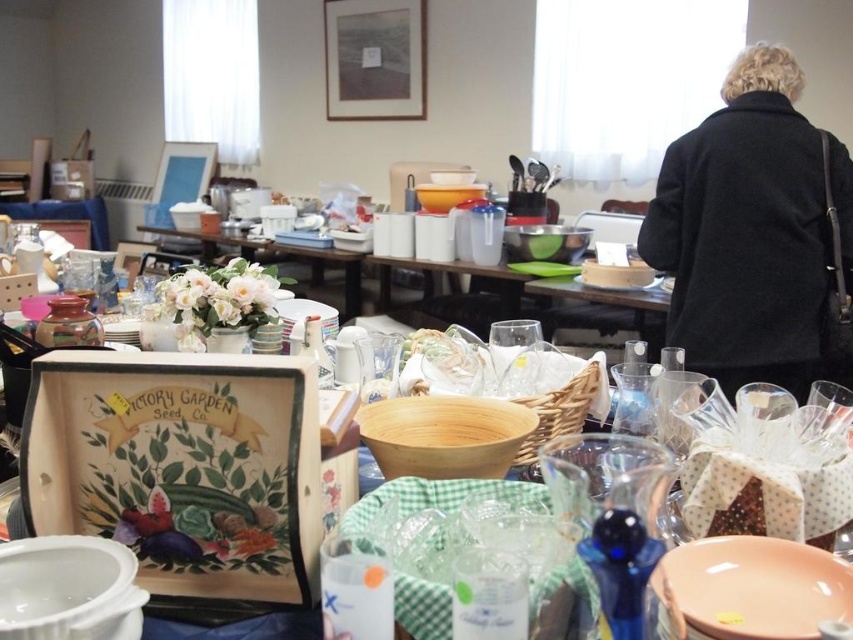
You are a customer at the flea market and want to examine both the black wool coat at upper right and the matte white plate at center. Which item would you need to move first to get a better look at the other?

The black wool coat at upper right is in front of the matte white plate at center, so you would need to move the black wool coat at upper right first to see the matte white plate at center clearly.

You are a customer at the flea market and want to know if the black wool coat at upper right can be placed on top of the matte white plate at center without falling off. Can it fit?

The black wool coat at upper right is taller than matte white plate at center, so it cannot be placed on top of the plate without falling off because its height exceeds the plate.